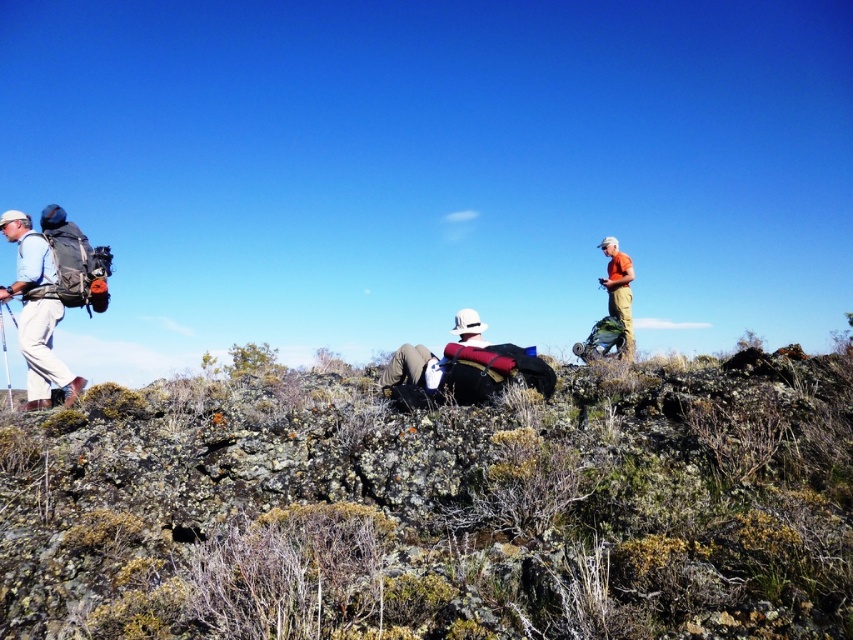
Question: Which point is closer to the camera?

Choices:
 (A) green mossy rock at center
 (B) matte black backpack at left

Answer: (A)

Question: Among these points, which one is farthest from the camera?

Choices:
 (A) (608, 312)
 (B) (27, 216)

Answer: (A)

Question: Is green mossy rock at center below matte black backpack at left?

Choices:
 (A) no
 (B) yes

Answer: (B)

Question: Observing the image, what is the correct spatial positioning of matte black backpack at left in reference to orange fabric shirt at upper right?

Choices:
 (A) above
 (B) below

Answer: (B)

Question: Is matte black backpack at left positioned before orange fabric shirt at upper right?

Choices:
 (A) no
 (B) yes

Answer: (B)

Question: Which of the following is the farthest from the observer?

Choices:
 (A) green mossy rock at center
 (B) orange fabric shirt at upper right

Answer: (B)